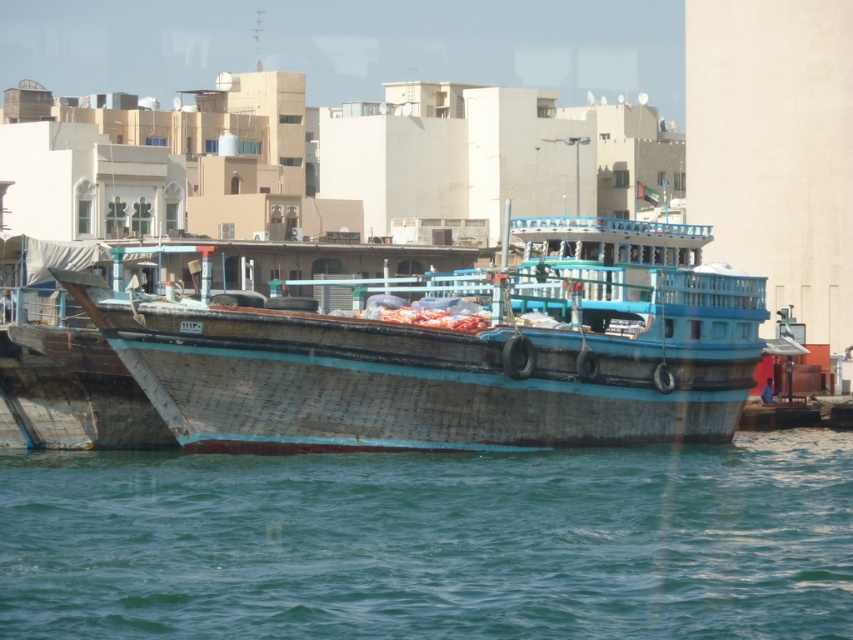
Question: Which of the following is the farthest from the observer?

Choices:
 (A) (727, 538)
 (B) (453, 362)

Answer: (B)

Question: Which object appears farthest from the camera in this image?

Choices:
 (A) wooden boat at center
 (B) teal matte water at lower center

Answer: (A)

Question: Can you confirm if teal matte water at lower center is positioned to the right of wooden boat at center?

Choices:
 (A) yes
 (B) no

Answer: (B)

Question: Can you confirm if teal matte water at lower center is positioned to the right of wooden boat at center?

Choices:
 (A) no
 (B) yes

Answer: (A)

Question: Is teal matte water at lower center to the right of wooden boat at center from the viewer's perspective?

Choices:
 (A) yes
 (B) no

Answer: (B)

Question: Which point appears farthest from the camera in this image?

Choices:
 (A) (476, 476)
 (B) (583, 323)

Answer: (B)